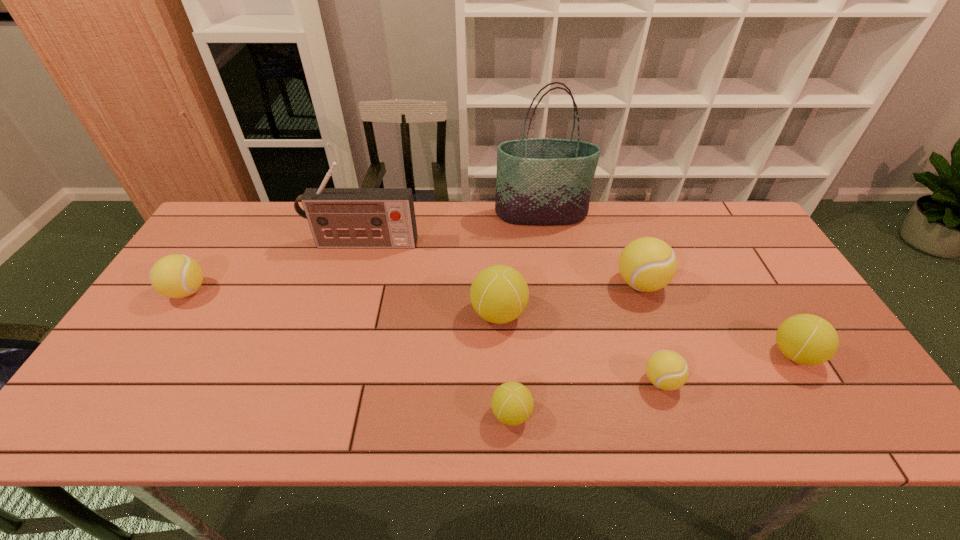
This screenshot has height=540, width=960. What are the coordinates of `vacant area in the image that satisfies the following two spatial constraints: 1. on the front panel of the biggest green tennis ball; 2. on the right side of the second farthest object` in the screenshot? It's located at (343, 313).